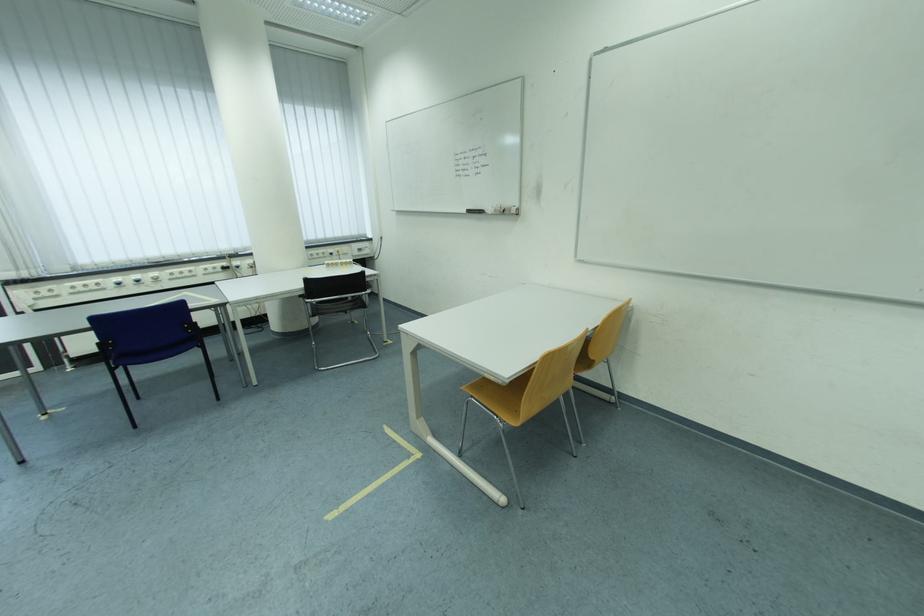
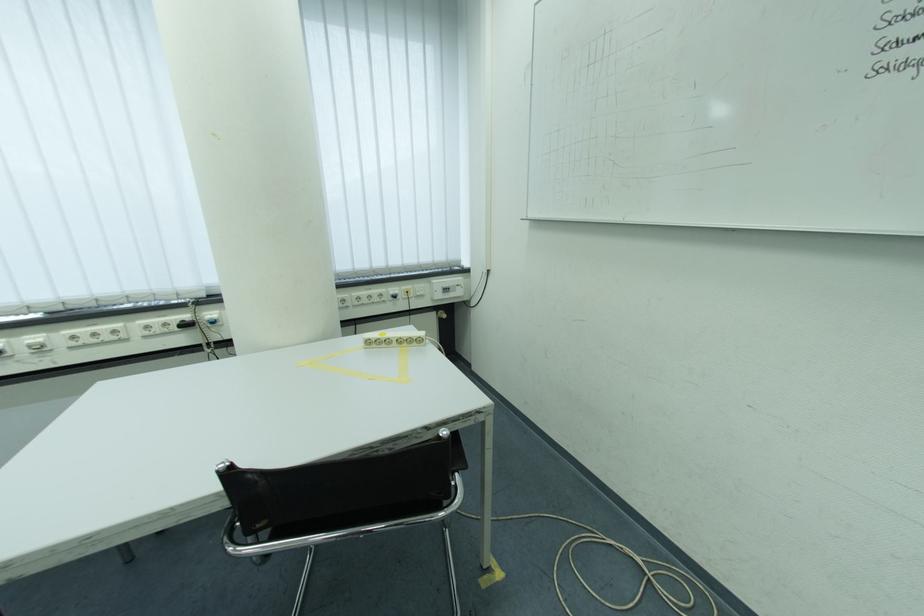
Find the pixel in the second image that matches the point at 247,270 in the first image.

(223, 325)